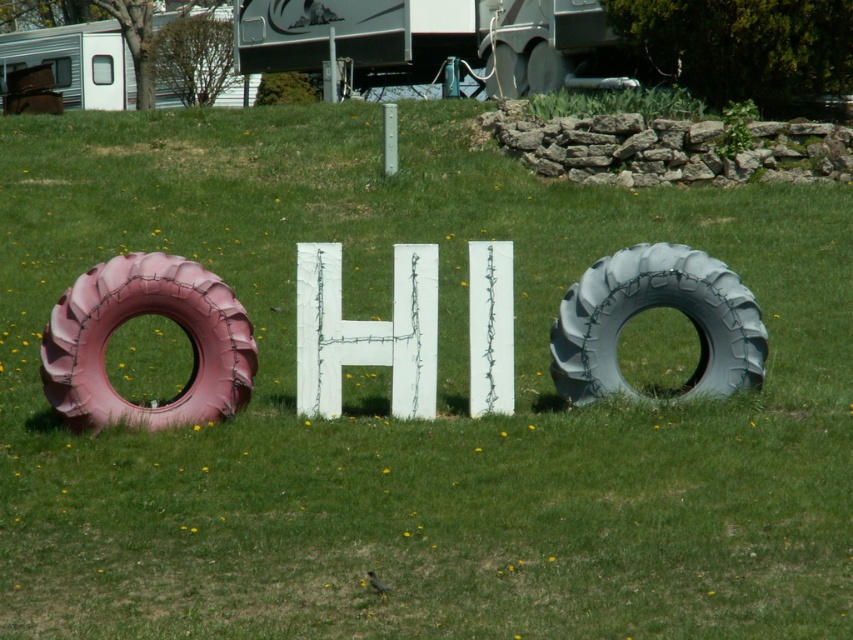
You are planning to move the brushed metal trailer at upper center and the white painted wood sign at center to a new location. If you want to place them side by side without overlapping, which object should you place first to ensure there is enough space?

You should place the white painted wood sign at center first because it occupies more space than the brushed metal trailer at upper center, ensuring there is enough room for both when placed side by side.